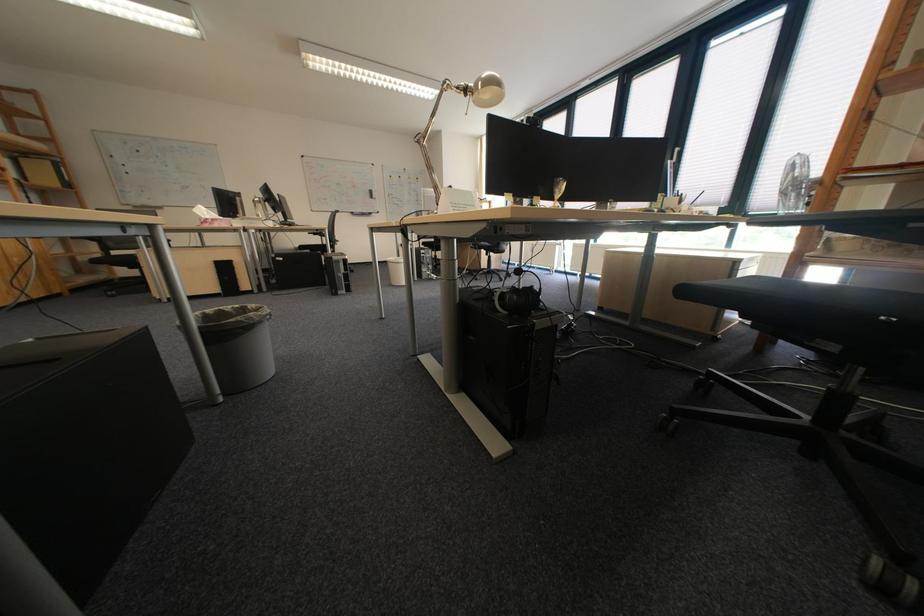
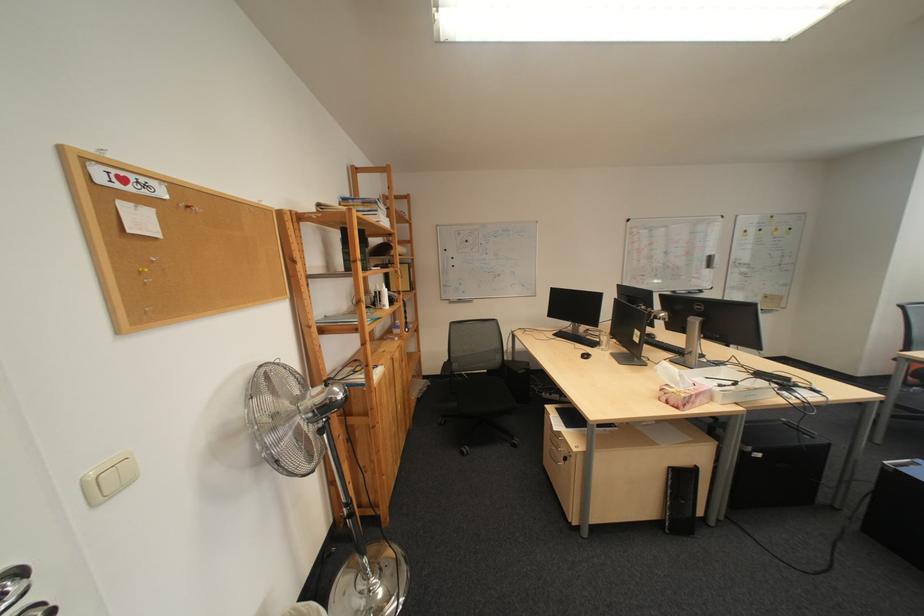
The point at [219,217] is marked in the first image. Where is the corresponding point in the second image?

(690, 385)